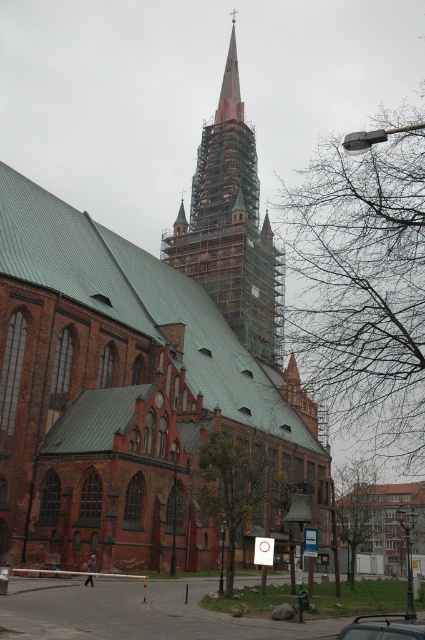
Question: Which point is closer to the camera?

Choices:
 (A) (248, 268)
 (B) (363, 628)

Answer: (B)

Question: Which object is closer to the camera taking this photo?

Choices:
 (A) wooden scaffolding at center
 (B) metallic silver car at center
 (C) brown brick church at center

Answer: (B)

Question: Is brown brick church at center thinner than wooden scaffolding at center?

Choices:
 (A) no
 (B) yes

Answer: (A)

Question: Is brown brick church at center thinner than wooden scaffolding at center?

Choices:
 (A) yes
 (B) no

Answer: (B)

Question: Which of the following is the farthest from the observer?

Choices:
 (A) (11, 433)
 (B) (359, 618)
 (C) (263, 266)

Answer: (C)

Question: Can you confirm if wooden scaffolding at center is wider than metallic silver car at center?

Choices:
 (A) no
 (B) yes

Answer: (B)